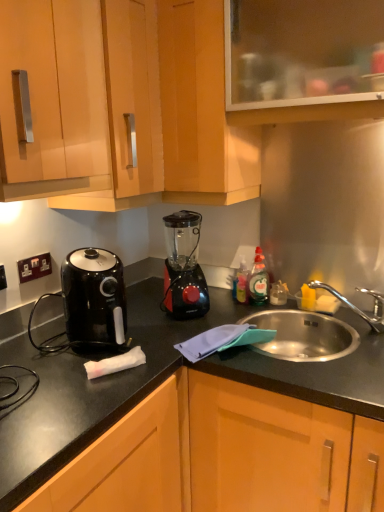
Question: Are black plastic electrical outlet at left, arranged as the first electric outlet when viewed from the back, and black plastic blender at center beside each other?

Choices:
 (A) yes
 (B) no

Answer: (B)

Question: From the image's perspective, is black plastic electrical outlet at left, the second electric outlet positioned from the left, above black plastic blender at center?

Choices:
 (A) yes
 (B) no

Answer: (B)

Question: Does black plastic electrical outlet at left, which ranks as the 2th electric outlet in front-to-back order, come behind black plastic blender at center?

Choices:
 (A) no
 (B) yes

Answer: (B)

Question: Would you say black plastic electrical outlet at left, the second electric outlet positioned from the left, is outside black plastic blender at center?

Choices:
 (A) no
 (B) yes

Answer: (B)

Question: Does black plastic electrical outlet at left, arranged as the first electric outlet when viewed from the back, have a greater width compared to black plastic blender at center?

Choices:
 (A) no
 (B) yes

Answer: (A)

Question: Is black plastic electrical outlet at left, arranged as the first electric outlet when viewed from the back, to the right of black plastic blender at center from the viewer's perspective?

Choices:
 (A) yes
 (B) no

Answer: (B)

Question: From a real-world perspective, does black plastic electrical outlet at left, the first electric outlet viewed from the right, stand above matte wood cabinets at upper center, the third cabinetry from the top?

Choices:
 (A) yes
 (B) no

Answer: (B)

Question: Considering the relative sizes of black plastic electrical outlet at left, the first electric outlet viewed from the right, and matte wood cabinets at upper center, the third cabinetry from the top, in the image provided, is black plastic electrical outlet at left, the first electric outlet viewed from the right, taller than matte wood cabinets at upper center, the third cabinetry from the top,?

Choices:
 (A) yes
 (B) no

Answer: (B)

Question: Considering the relative sizes of black plastic electrical outlet at left, which ranks as the 2th electric outlet in front-to-back order, and matte wood cabinets at upper center, which appears as the 3th cabinetry when ordered from the bottom, in the image provided, is black plastic electrical outlet at left, which ranks as the 2th electric outlet in front-to-back order, shorter than matte wood cabinets at upper center, which appears as the 3th cabinetry when ordered from the bottom,?

Choices:
 (A) no
 (B) yes

Answer: (B)

Question: Can you confirm if black plastic electrical outlet at left, the first electric outlet viewed from the right, is positioned to the right of matte wood cabinets at upper center, the third cabinetry from the top?

Choices:
 (A) no
 (B) yes

Answer: (A)

Question: Is black plastic electrical outlet at left, the first electric outlet viewed from the right, with matte wood cabinets at upper center, which appears as the 3th cabinetry when ordered from the bottom?

Choices:
 (A) no
 (B) yes

Answer: (A)

Question: Does black plastic electrical outlet at left, the first electric outlet viewed from the right, lie behind matte wood cabinets at upper center, which appears as the 3th cabinetry when ordered from the bottom?

Choices:
 (A) no
 (B) yes

Answer: (B)

Question: Considering the relative sizes of black glossy air fryer at left and black plastic electrical outlet at left, which ranks as the 2th electric outlet in front-to-back order, in the image provided, is black glossy air fryer at left thinner than black plastic electrical outlet at left, which ranks as the 2th electric outlet in front-to-back order,?

Choices:
 (A) no
 (B) yes

Answer: (A)